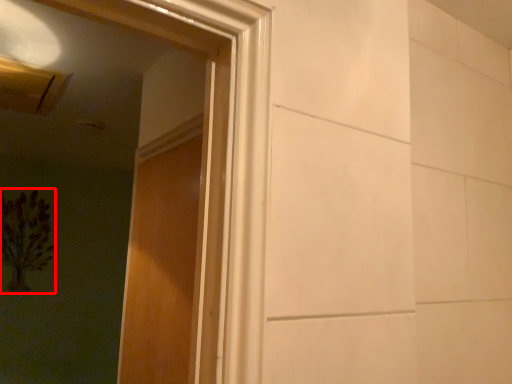
Question: From the image's perspective, what is the correct spatial relationship of flower (annotated by the red box) in relation to door?

Choices:
 (A) below
 (B) above

Answer: (A)